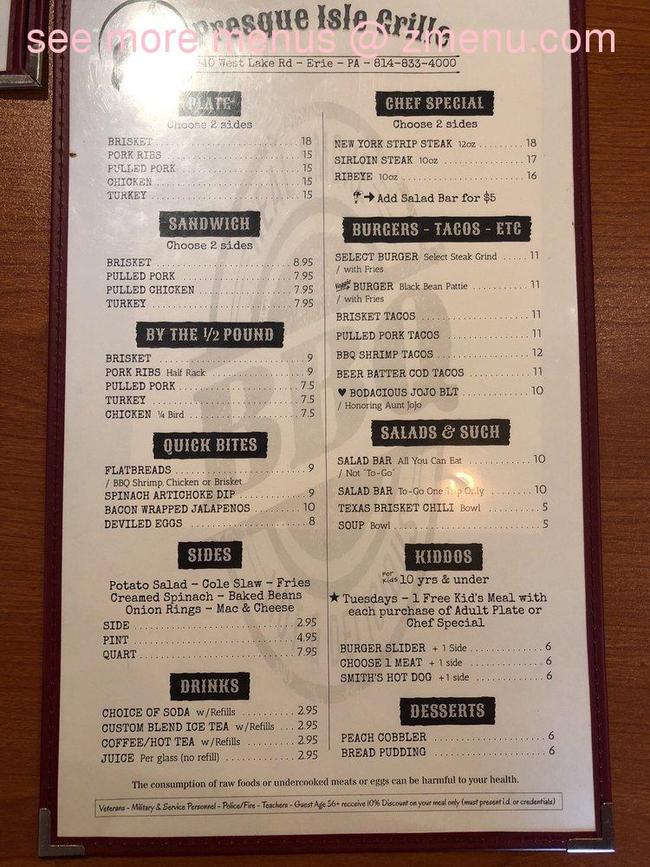
Locate an element on the screen. The image size is (650, 867). plate is located at coordinates (201, 101).